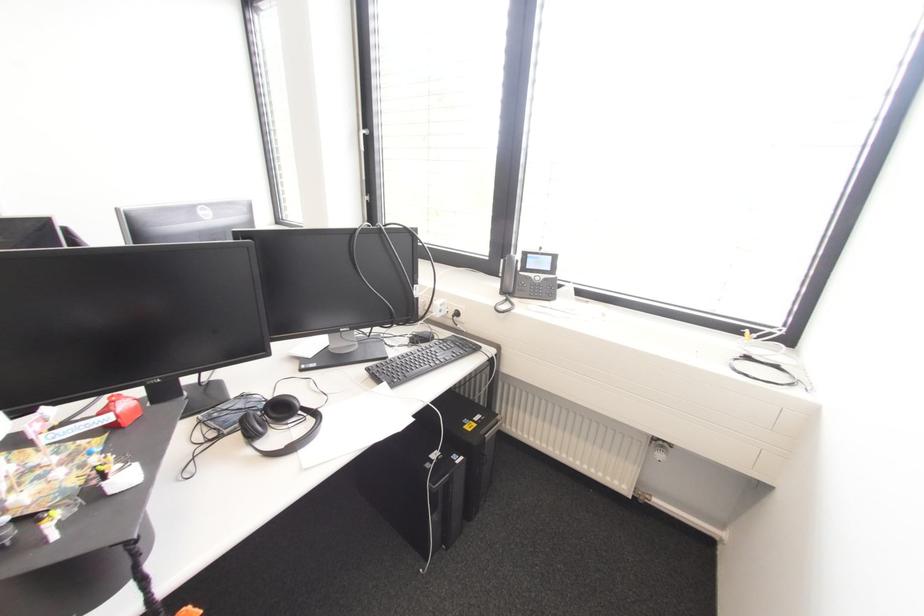
Locate an element on the screen. The image size is (924, 616). phone handset is located at coordinates (507, 275).